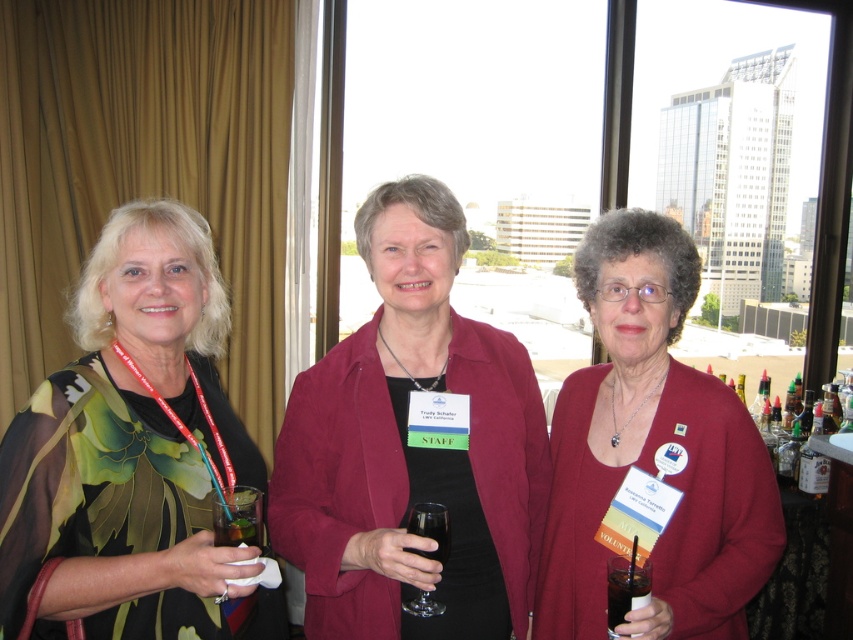
Which of these two, maroon suede jacket at center or transparent glass at center, stands taller?

maroon suede jacket at center

Is maroon suede jacket at center thinner than transparent glass at center?

No, maroon suede jacket at center is not thinner than transparent glass at center.

The width and height of the screenshot is (853, 640). Find the location of `maroon suede jacket at center`. maroon suede jacket at center is located at coordinates (412, 445).

Is point (26, 438) positioned after point (428, 596)?

No, it is in front of (428, 596).

The image size is (853, 640). What are the coordinates of `floral-patterned fabric at left` in the screenshot? It's located at (128, 448).

Is dark liquid glass at center above transparent glass at center?

Actually, dark liquid glass at center is below transparent glass at center.

Does dark liquid glass at center have a greater height compared to transparent glass at center?

In fact, dark liquid glass at center may be shorter than transparent glass at center.

Is point (625, 570) in front of point (404, 600)?

Yes, it is.

The height and width of the screenshot is (640, 853). Identify the location of dark liquid glass at center. [625, 588].